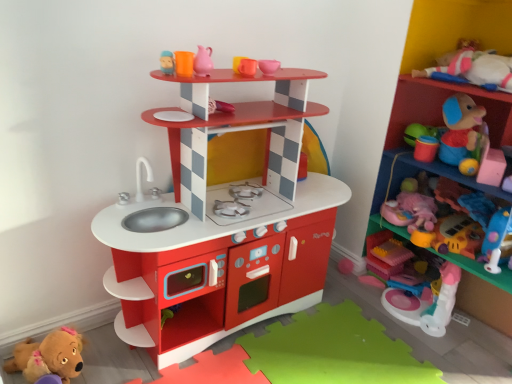
I want to click on free space to the back side of brown plush toy at lower left, which ranks as the first toy in bottom-to-top order, so click(x=98, y=339).